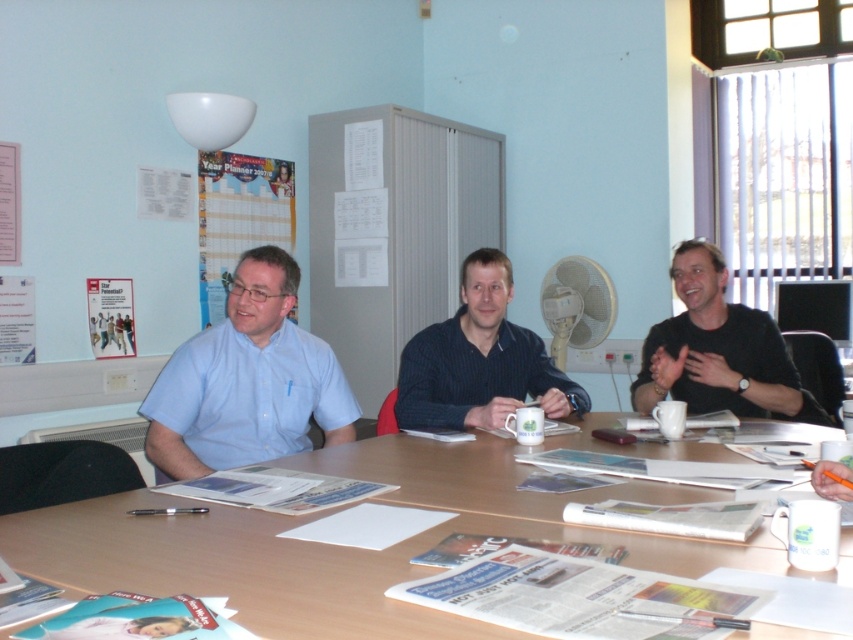
Question: Does wooden table at center appear over black matte shirt at center?

Choices:
 (A) no
 (B) yes

Answer: (A)

Question: Can you confirm if wooden table at center is positioned below black matte shirt at center?

Choices:
 (A) no
 (B) yes

Answer: (B)

Question: Is wooden table at center to the left of black matte shirt at center from the viewer's perspective?

Choices:
 (A) yes
 (B) no

Answer: (A)

Question: Which object is positioned farthest from the wooden table at center?

Choices:
 (A) dark blue textured shirt at center
 (B) black matte shirt at center

Answer: (B)

Question: Among these objects, which one is nearest to the camera?

Choices:
 (A) black matte shirt at center
 (B) dark blue textured shirt at center
 (C) wooden table at center

Answer: (C)

Question: Which of the following is the closest to the observer?

Choices:
 (A) tap(753, 400)
 (B) tap(167, 392)
 (C) tap(747, 541)

Answer: (C)